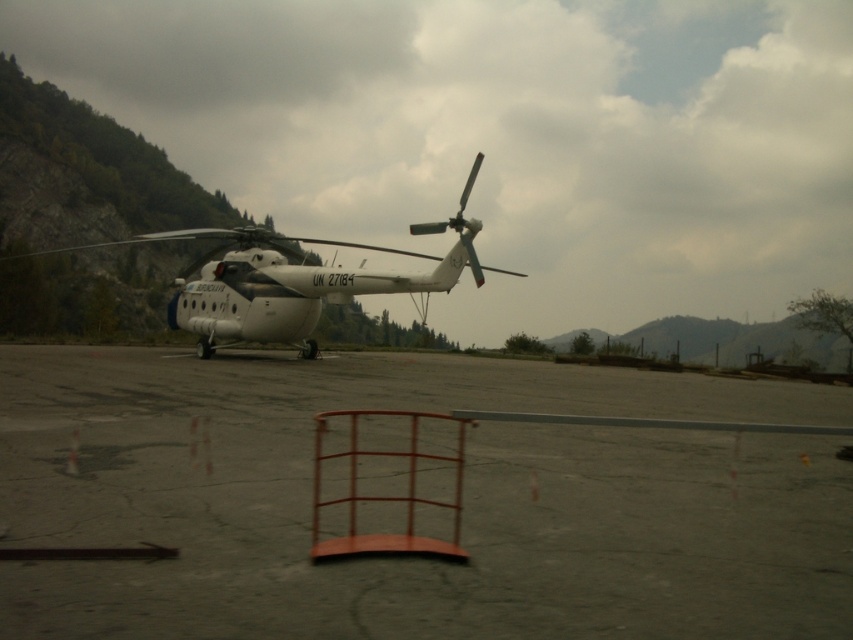
You are a pilot standing on the gray concrete tarmac at center and want to board the white matte helicopter at center. Which direction should you move to reach the helicopter?

Since the gray concrete tarmac at center is closer to the viewer than the white matte helicopter at center, you should move backward to reach the white matte helicopter at center.